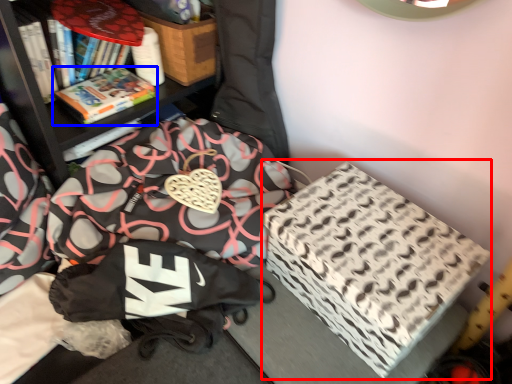
Question: Which object is closer to the camera taking this photo, cardboard box (highlighted by a red box) or book (highlighted by a blue box)?

Choices:
 (A) cardboard box
 (B) book

Answer: (A)